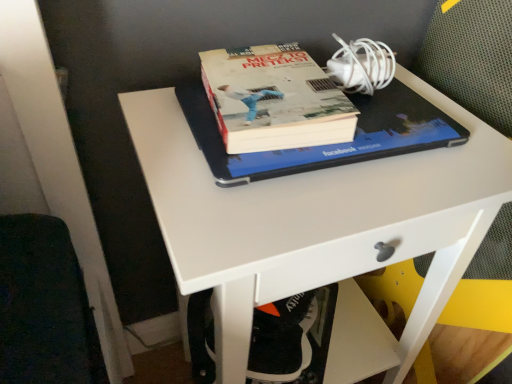
At what (x,y) coordinates should I click in order to perform the action: click on blank space situated above white matte desk at center (from a real-world perspective). Please return your answer as a coordinate pair (x, y). Looking at the image, I should click on (347, 164).